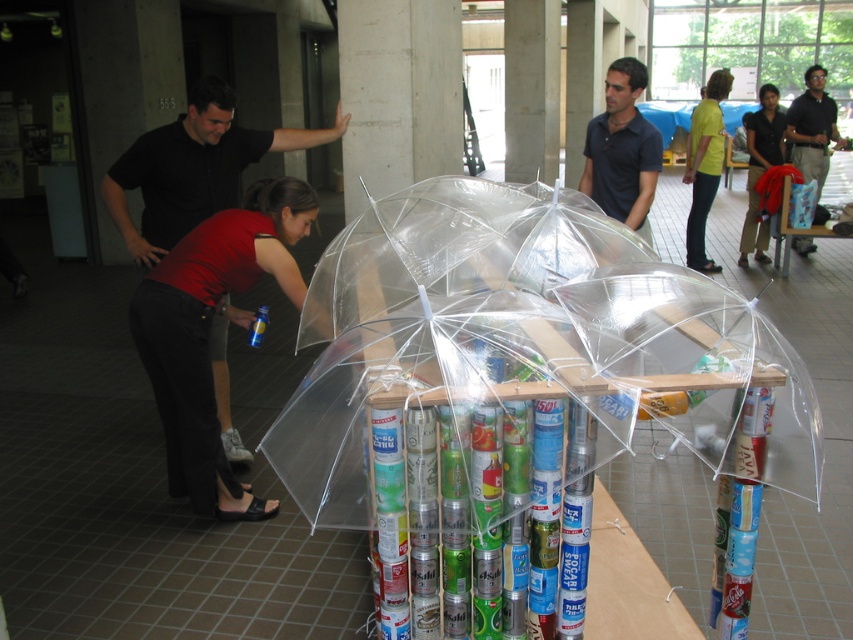
Which is more to the right, yellow matte shirt at upper right or matte black shirt at upper right?

From the viewer's perspective, matte black shirt at upper right appears more on the right side.

Where is `yellow matte shirt at upper right`? The height and width of the screenshot is (640, 853). yellow matte shirt at upper right is located at coordinates (704, 166).

At what (x,y) coordinates should I click in order to perform the action: click on yellow matte shirt at upper right. Please return your answer as a coordinate pair (x, y). Image resolution: width=853 pixels, height=640 pixels. Looking at the image, I should click on (704, 166).

Does matte black shirt at center appear under black polo shirt at upper right?

Correct, matte black shirt at center is located below black polo shirt at upper right.

Can you confirm if matte black shirt at center is positioned to the right of black polo shirt at upper right?

Incorrect, matte black shirt at center is not on the right side of black polo shirt at upper right.

Does point (621, 132) lie in front of point (820, 140)?

Yes, point (621, 132) is closer to viewer.

Find the location of `matte black shirt at center`. matte black shirt at center is located at coordinates (622, 148).

Between matte red shirt at lower left and matte black shirt at upper right, which one appears on the left side from the viewer's perspective?

Positioned to the left is matte red shirt at lower left.

Is point (201, 314) positioned after point (761, 88)?

No, it is not.

Which is in front, point (245, 289) or point (753, 236)?

Point (245, 289)

I want to click on matte red shirt at lower left, so [x=210, y=332].